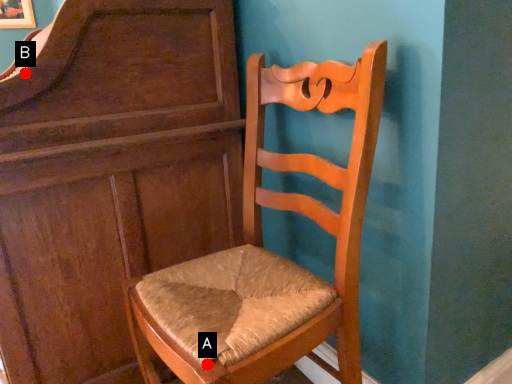
Question: Two points are circled on the image, labeled by A and B beside each circle. Among these points, which one is nearest to the camera?

Choices:
 (A) A is closer
 (B) B is closer

Answer: (A)